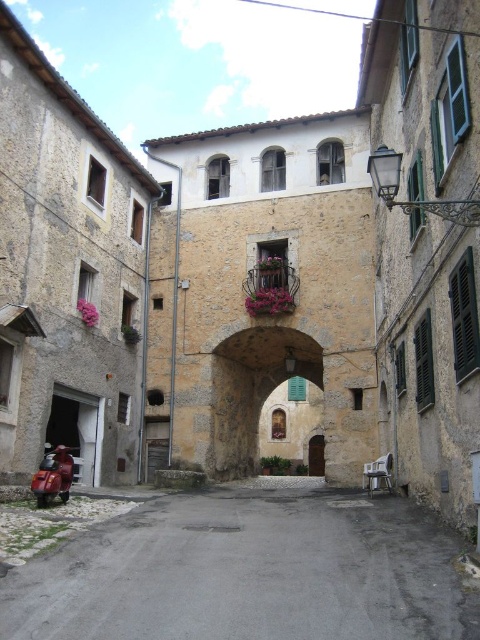
Question: Can you confirm if stone archway at center is positioned to the left of metallic red scooter at lower left?

Choices:
 (A) no
 (B) yes

Answer: (A)

Question: Which object is farther from the camera taking this photo?

Choices:
 (A) stone archway at center
 (B) gray concrete alley at center

Answer: (A)

Question: Considering the real-world distances, which object is farthest from the metallic red scooter at lower left?

Choices:
 (A) gray concrete alley at center
 (B) stone archway at center

Answer: (B)

Question: In this image, where is gray concrete alley at center located relative to stone archway at center?

Choices:
 (A) left
 (B) right

Answer: (A)

Question: Among these points, which one is nearest to the camera?

Choices:
 (A) (44, 572)
 (B) (213, 467)
 (C) (68, 492)

Answer: (A)

Question: Does stone archway at center appear on the left side of metallic red scooter at lower left?

Choices:
 (A) yes
 (B) no

Answer: (B)